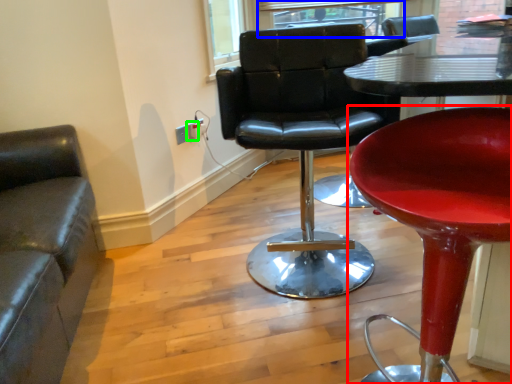
Question: Estimate the real-world distances between objects in this image. Which object is farther from chair (highlighted by a red box), window (highlighted by a blue box) or electric outlet (highlighted by a green box)?

Choices:
 (A) window
 (B) electric outlet

Answer: (A)